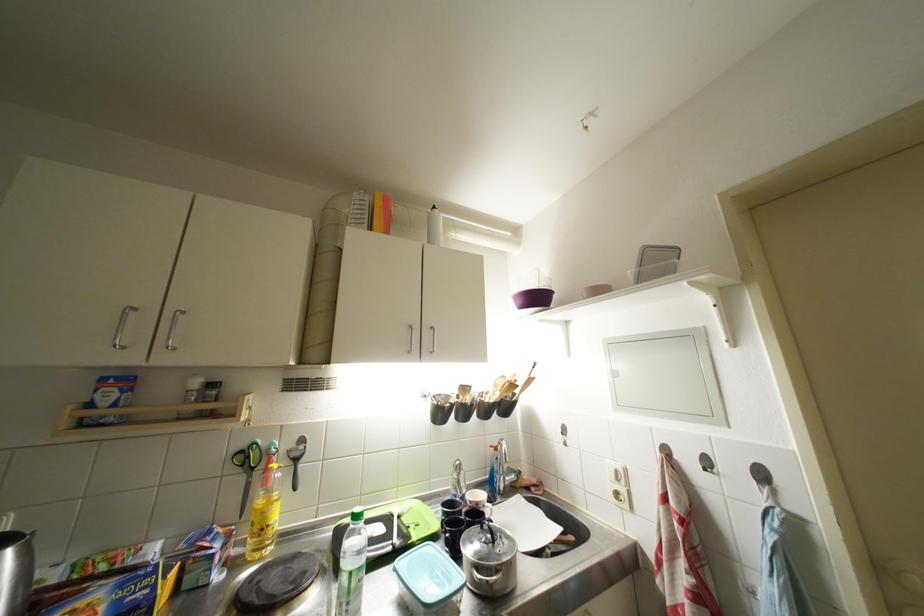
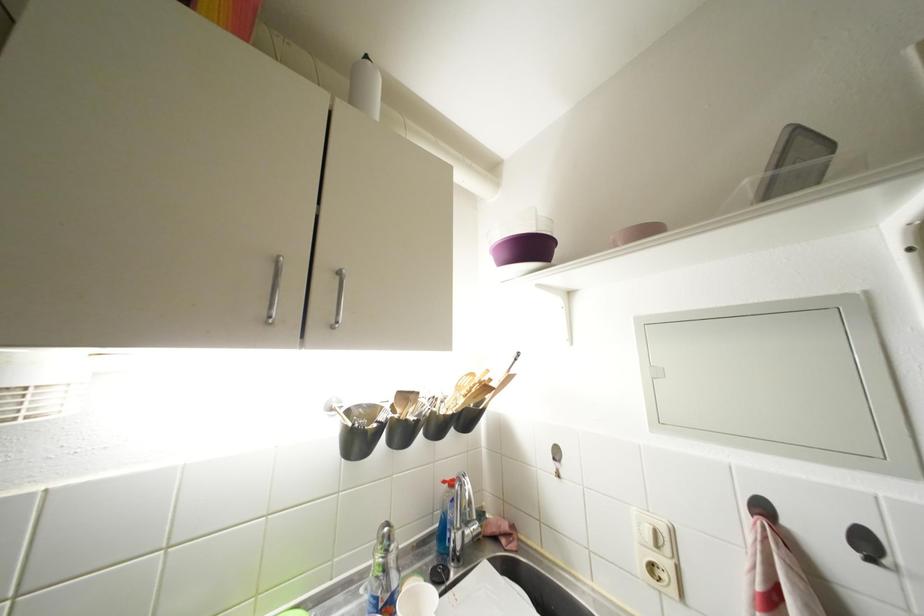
Locate, in the second image, the point that corresponds to pixel 511 381 in the first image.

(479, 379)